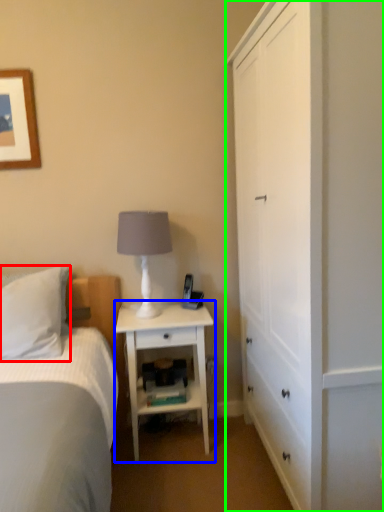
Question: Which object is the closest to the pillow (highlighted by a red box)? Choose among these: nightstand (highlighted by a blue box) or cabinetry (highlighted by a green box).

Choices:
 (A) nightstand
 (B) cabinetry

Answer: (A)